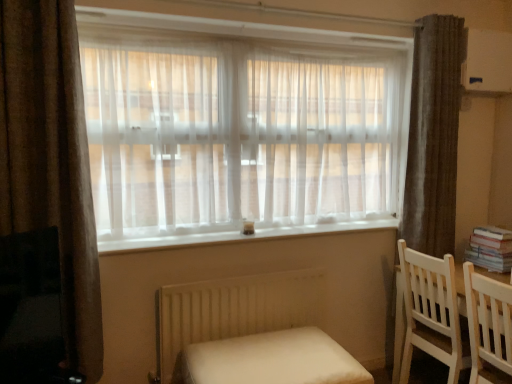
What is the approximate width of brown velvet curtain at left, which is the 1th curtain from front to back?

brown velvet curtain at left, which is the 1th curtain from front to back, is 8.10 inches wide.

Describe the element at coordinates (431, 312) in the screenshot. This screenshot has width=512, height=384. I see `white wood chair at lower right, which ranks as the 2th chair in front-to-back order` at that location.

The width and height of the screenshot is (512, 384). What do you see at coordinates (234, 310) in the screenshot?
I see `white matte radiator at lower center` at bounding box center [234, 310].

This screenshot has width=512, height=384. Find the location of `translucent fabric window at center`. translucent fabric window at center is located at coordinates (241, 131).

Image resolution: width=512 pixels, height=384 pixels. What do you see at coordinates (241, 131) in the screenshot? I see `translucent fabric window at center` at bounding box center [241, 131].

This screenshot has width=512, height=384. What do you see at coordinates (490, 249) in the screenshot?
I see `white paper book at right` at bounding box center [490, 249].

The image size is (512, 384). I want to click on white paper book at right, so coord(490,249).

Describe the element at coordinates (433, 135) in the screenshot. I see `brown textured curtain at right, arranged as the second curtain when viewed from the left` at that location.

This screenshot has width=512, height=384. Identify the location of white wooden chair at right, the 1th chair in the front-to-back sequence. (489, 327).

At what (x,y) coordinates should I click in order to perform the action: click on white fabric bed at lower center. Please return your answer as a coordinate pair (x, y). The height and width of the screenshot is (384, 512). Looking at the image, I should click on (270, 360).

From the image's perspective, is white smooth window sill at center above or below white fabric bed at lower center?

Based on their image positions, white smooth window sill at center is located above white fabric bed at lower center.

Is white smooth window sill at center in front of white fabric bed at lower center?

No.

Is white smooth window sill at center facing towards white fabric bed at lower center?

No, white smooth window sill at center is not aimed at white fabric bed at lower center.

Is white fabric bed at lower center outside of brown velvet curtain at left, which appears as the second curtain when viewed from the right?

white fabric bed at lower center is positioned outside brown velvet curtain at left, which appears as the second curtain when viewed from the right.

Find the location of a particular element. furniture that is below the brown velvet curtain at left, the first curtain from the left (from the image's perspective) is located at coordinates (270, 360).

Is white fabric bed at lower center positioned with its back to brown velvet curtain at left, the first curtain from the left?

No, white fabric bed at lower center's orientation is not away from brown velvet curtain at left, the first curtain from the left.

Is white fabric bed at lower center closer to the viewer compared to brown velvet curtain at left, which appears as the second curtain when viewed from the right?

Yes.

From the image's perspective, is translucent fabric window at center under brown textured curtain at right, the 1th curtain when ordered from right to left?

No.

Does translucent fabric window at center touch brown textured curtain at right, acting as the second curtain starting from the front?

translucent fabric window at center and brown textured curtain at right, acting as the second curtain starting from the front, are clearly separated.

Who is smaller, translucent fabric window at center or brown textured curtain at right, the 1th curtain when ordered from right to left?

With smaller size is brown textured curtain at right, the 1th curtain when ordered from right to left.

Can brown textured curtain at right, acting as the second curtain starting from the front, be found inside translucent fabric window at center?

Definitely not — brown textured curtain at right, acting as the second curtain starting from the front, is not inside translucent fabric window at center.

Identify the location of furniture below the white paper book at right (from the image's perspective). (270, 360).

From the image's perspective, is white fabric bed at lower center on white paper book at right?

No, from the image's perspective, white fabric bed at lower center is not on top of white paper book at right.

Is white fabric bed at lower center in front of or behind white paper book at right in the image?

Visually, white fabric bed at lower center is located in front of white paper book at right.

Does point (237, 380) come behind point (476, 254)?

No, it is not.

From the image's perspective, does translucent fabric window at center appear higher than white paper book at right?

Correct, translucent fabric window at center appears higher than white paper book at right in the image.

In the scene shown: Is translucent fabric window at center oriented towards white paper book at right?

Yes, translucent fabric window at center is aimed at white paper book at right.

From a real-world perspective, who is located lower, translucent fabric window at center or white paper book at right?

white paper book at right is physically lower.

Is translucent fabric window at center in contact with white paper book at right?

translucent fabric window at center is not next to white paper book at right, and they're not touching.

Between point (213, 370) and point (425, 222), which one is positioned behind?

The point (425, 222) is more distant.

Is white fabric bed at lower center far away from brown textured curtain at right, placed as the first curtain when sorted from back to front?

Yes, white fabric bed at lower center and brown textured curtain at right, placed as the first curtain when sorted from back to front, are quite far apart.

Based on the photo, considering their positions, is white fabric bed at lower center located in front of or behind brown textured curtain at right, arranged as the second curtain when viewed from the left?

In the image, white fabric bed at lower center appears in front of brown textured curtain at right, arranged as the second curtain when viewed from the left.

Does white fabric bed at lower center have a lesser height compared to brown textured curtain at right, arranged as the second curtain when viewed from the left?

Yes.

Is the position of white smooth window sill at center more distant than that of brown velvet curtain at left, which is the 1th curtain from front to back?

Yes.

From the picture: Is white smooth window sill at center aimed at brown velvet curtain at left, which is the 1th curtain from front to back?

No, white smooth window sill at center is not aimed at brown velvet curtain at left, which is the 1th curtain from front to back.

Measure the distance between white smooth window sill at center and brown velvet curtain at left, which is the second curtain in back-to-front order.

white smooth window sill at center and brown velvet curtain at left, which is the second curtain in back-to-front order, are 27.15 inches apart.

Considering the positions of points (365, 221) and (58, 136), is point (365, 221) closer to camera compared to point (58, 136)?

That is False.

This screenshot has height=384, width=512. What are the coordinates of `furniture below the white smooth window sill at center (from the image's perspective)` in the screenshot? It's located at (270, 360).

Identify the location of furniture below the brown velvet curtain at left, which is the 1th curtain from front to back (from a real-world perspective). This screenshot has width=512, height=384. (270, 360).

Which object lies further to the anchor point white paper book at right, brown velvet curtain at left, which appears as the second curtain when viewed from the right, or white smooth window sill at center?

brown velvet curtain at left, which appears as the second curtain when viewed from the right, is positioned further to the anchor white paper book at right.

Estimate the real-world distances between objects in this image. Which object is further from white smooth window sill at center, brown textured curtain at right, placed as the first curtain when sorted from back to front, or white matte radiator at lower center?

brown textured curtain at right, placed as the first curtain when sorted from back to front, is positioned further to the anchor white smooth window sill at center.

Which object lies nearer to the anchor point white fabric bed at lower center, translucent fabric window at center or white wood chair at lower right, which is the first chair from back to front?

white wood chair at lower right, which is the first chair from back to front.

Based on their spatial positions, is brown velvet curtain at left, which is the 1th curtain from front to back, or white smooth window sill at center closer to translucent fabric window at center?

white smooth window sill at center is positioned closer to the anchor translucent fabric window at center.

Based on their spatial positions, is white wooden chair at right, the 1th chair in the front-to-back sequence, or brown velvet curtain at left, which appears as the second curtain when viewed from the right, further from white smooth window sill at center?

white wooden chair at right, the 1th chair in the front-to-back sequence, lies further to white smooth window sill at center than the other object.

Looking at the image, which one is located closer to white fabric bed at lower center, white wood chair at lower right, which ranks as the 2th chair in front-to-back order, or brown textured curtain at right, the 1th curtain when ordered from right to left?

white wood chair at lower right, which ranks as the 2th chair in front-to-back order, is closer to white fabric bed at lower center.

Which object lies nearer to the anchor point white paper book at right, white matte radiator at lower center or white wooden chair at right, which is the 2th chair in back-to-front order?

white wooden chair at right, which is the 2th chair in back-to-front order, lies closer to white paper book at right than the other object.

When comparing their distances from white smooth window sill at center, does translucent fabric window at center or brown textured curtain at right, acting as the second curtain starting from the front, seem further?

brown textured curtain at right, acting as the second curtain starting from the front.

Identify the location of window sill located between white fabric bed at lower center and white paper book at right in the left-right direction. Image resolution: width=512 pixels, height=384 pixels. (236, 233).

Identify the location of window sill between translucent fabric window at center and brown textured curtain at right, the 1th curtain when ordered from right to left. This screenshot has width=512, height=384. (236, 233).

Locate an element on the screen. This screenshot has width=512, height=384. furniture located between translucent fabric window at center and white wood chair at lower right, which is the first chair from back to front, in the left-right direction is located at coordinates (270, 360).

You are a GUI agent. You are given a task and a screenshot of the screen. Output one action in this format:
    pyautogui.click(x=<x>, y=<y>)
    Task: Click on the radiator situated between brown velvet curtain at left, the first curtain from the left, and white fabric bed at lower center from left to right
    
    Given the screenshot: What is the action you would take?
    pyautogui.click(x=234, y=310)